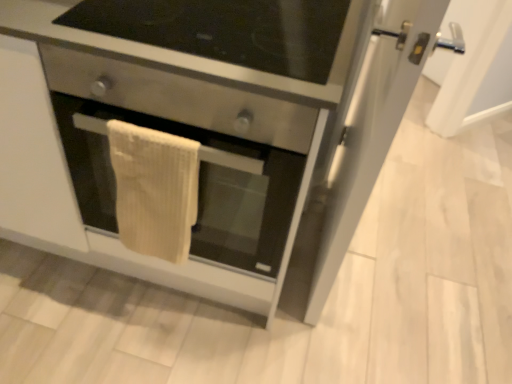
You are a GUI agent. You are given a task and a screenshot of the screen. Output one action in this format:
    pyautogui.click(x=<x>, y=<y>)
    Task: Click on the stainless steel drawer at center
    
    Given the screenshot: What is the action you would take?
    pyautogui.click(x=179, y=98)

Find the location of a particular element. The image size is (512, 384). stainless steel drawer at center is located at coordinates (179, 98).

From the image's perspective, is stainless steel oven at center located above or below stainless steel drawer at center?

Clearly, from the image's perspective, stainless steel oven at center is below stainless steel drawer at center.

Considering the relative sizes of stainless steel oven at center and stainless steel drawer at center in the image provided, is stainless steel oven at center wider than stainless steel drawer at center?

Yes.

Consider the image. How many degrees apart are the facing directions of stainless steel oven at center and stainless steel drawer at center?

stainless steel oven at center and stainless steel drawer at center are facing 0.772 degrees away from each other.

Is stainless steel oven at center shorter than stainless steel drawer at center?

In fact, stainless steel oven at center may be taller than stainless steel drawer at center.

Does transparent glass door at right appear on the right side of stainless steel drawer at center?

Indeed, transparent glass door at right is positioned on the right side of stainless steel drawer at center.

Considering the relative sizes of transparent glass door at right and stainless steel drawer at center in the image provided, is transparent glass door at right smaller than stainless steel drawer at center?

Incorrect, transparent glass door at right is not smaller in size than stainless steel drawer at center.

Are transparent glass door at right and stainless steel drawer at center located far from each other?

No, transparent glass door at right is in close proximity to stainless steel drawer at center.

Between transparent glass door at right and stainless steel drawer at center, which one has smaller width?

With smaller width is transparent glass door at right.

How much distance is there between stainless steel drawer at center and stainless steel oven at center?

The distance of stainless steel drawer at center from stainless steel oven at center is 7.21 inches.

Is stainless steel drawer at center positioned before stainless steel oven at center?

Yes, stainless steel drawer at center is in front of stainless steel oven at center.

Could you tell me if stainless steel drawer at center is turned towards stainless steel oven at center?

No, stainless steel drawer at center is not turned towards stainless steel oven at center.

Between stainless steel drawer at center and stainless steel oven at center, which one appears on the left side from the viewer's perspective?

stainless steel oven at center is more to the left.

Consider the image. Is stainless steel drawer at center not within transparent glass door at right?

Indeed, stainless steel drawer at center is completely outside transparent glass door at right.

Which object is wider, stainless steel drawer at center or transparent glass door at right?

stainless steel drawer at center.

From a real-world perspective, is stainless steel drawer at center on transparent glass door at right?

Yes, from a real-world perspective, stainless steel drawer at center is on top of transparent glass door at right.

Which object is positioned more to the right, stainless steel drawer at center or transparent glass door at right?

Positioned to the right is transparent glass door at right.

Between transparent glass door at right and stainless steel oven at center, which one has larger size?

Bigger between the two is stainless steel oven at center.

Measure the distance from transparent glass door at right to stainless steel oven at center.

transparent glass door at right is 14.95 inches away from stainless steel oven at center.

Does transparent glass door at right have a greater width compared to stainless steel oven at center?

No.

Which is closer, (398, 106) or (289, 166)?

The point (398, 106) is more forward.

From the image's perspective, relative to stainless steel drawer at center, is beige textured towel at center above or below?

beige textured towel at center is below stainless steel drawer at center.

I want to click on drawer above the beige textured towel at center (from a real-world perspective), so click(179, 98).

Between point (123, 192) and point (210, 97), which one is positioned behind?

Point (123, 192)

Is beige textured towel at center turned away from stainless steel drawer at center?

Yes, beige textured towel at center is positioned with its back facing stainless steel drawer at center.

Is point (167, 154) closer to camera compared to point (88, 156)?

Yes, it is.

Is beige textured towel at center oriented away from stainless steel oven at center?

Yes, beige textured towel at center's orientation is away from stainless steel oven at center.

Does beige textured towel at center appear on the right side of stainless steel oven at center?

Incorrect, beige textured towel at center is not on the right side of stainless steel oven at center.

Find the location of a particular element. The height and width of the screenshot is (384, 512). oven that appears in front of the beige textured towel at center is located at coordinates (199, 187).

In order to click on drawer that appears above the stainless steel oven at center (from the image's perspective) in this screenshot , I will do `click(179, 98)`.

Where is `glass door on the right of stainless steel drawer at center`? The width and height of the screenshot is (512, 384). glass door on the right of stainless steel drawer at center is located at coordinates (358, 144).

When comparing their distances from stainless steel drawer at center, does transparent glass door at right or stainless steel oven at center seem closer?

stainless steel oven at center.

Estimate the real-world distances between objects in this image. Which object is closer to stainless steel oven at center, beige textured towel at center or stainless steel drawer at center?

beige textured towel at center lies closer to stainless steel oven at center than the other object.

Based on their spatial positions, is transparent glass door at right or beige textured towel at center further from stainless steel oven at center?

transparent glass door at right.

When comparing their distances from beige textured towel at center, does stainless steel oven at center or transparent glass door at right seem further?

The object further to beige textured towel at center is transparent glass door at right.

When comparing their distances from stainless steel oven at center, does stainless steel drawer at center or transparent glass door at right seem further?

Among the two, transparent glass door at right is located further to stainless steel oven at center.

Considering their positions, is stainless steel oven at center positioned closer to stainless steel drawer at center than transparent glass door at right?

Among the two, stainless steel oven at center is located nearer to stainless steel drawer at center.

Considering their positions, is transparent glass door at right positioned further to beige textured towel at center than stainless steel drawer at center?

Among the two, transparent glass door at right is located further to beige textured towel at center.

From the image, which object appears to be farther from transparent glass door at right, stainless steel drawer at center or stainless steel oven at center?

Among the two, stainless steel drawer at center is located further to transparent glass door at right.

This screenshot has width=512, height=384. I want to click on drawer situated between beige textured towel at center and transparent glass door at right from left to right, so click(x=179, y=98).

Locate an element on the screen. oven located between beige textured towel at center and transparent glass door at right in the left-right direction is located at coordinates (199, 187).

Where is `drawer between stainless steel oven at center and transparent glass door at right from left to right`? This screenshot has height=384, width=512. drawer between stainless steel oven at center and transparent glass door at right from left to right is located at coordinates (179, 98).

At what (x,y) coordinates should I click in order to perform the action: click on oven that lies between stainless steel drawer at center and beige textured towel at center from top to bottom. Please return your answer as a coordinate pair (x, y). Looking at the image, I should click on (199, 187).